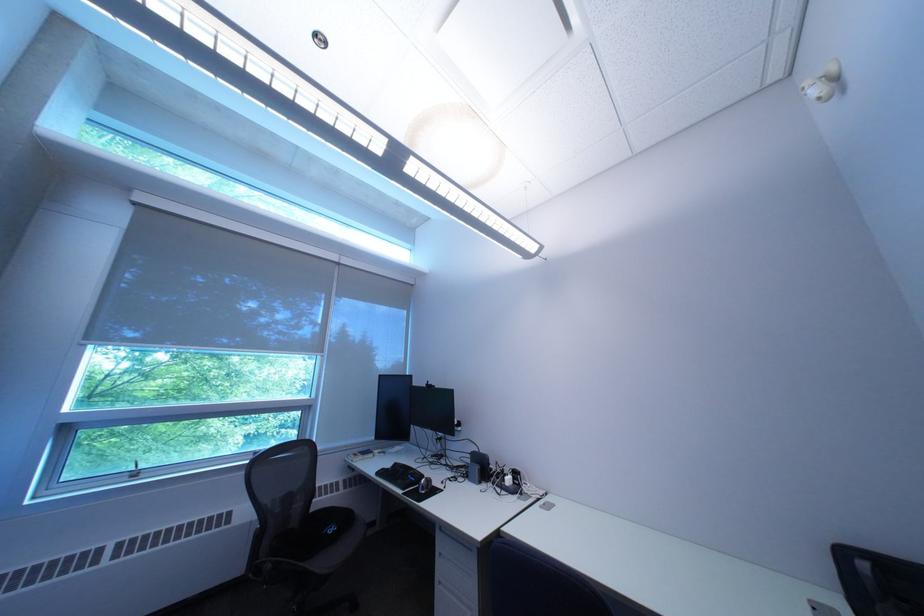
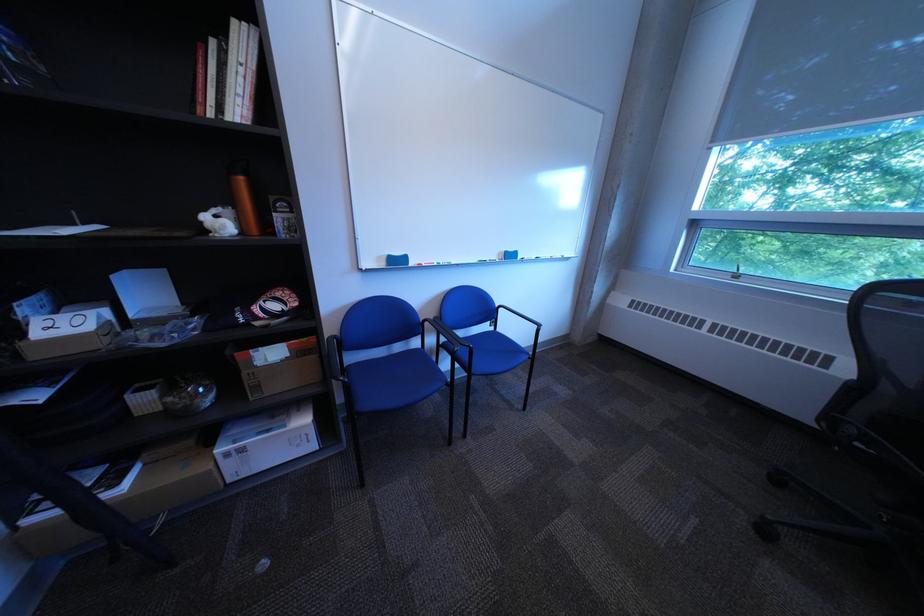
Based on the continuous images, in which direction is the camera rotating?

The camera's rotation is toward left-down.